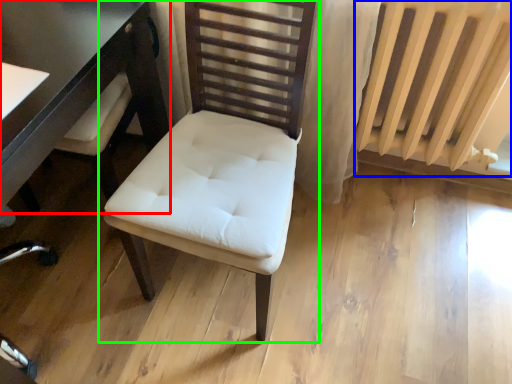
Question: Which is farther away from table (highlighted by a red box)? radiator (highlighted by a blue box) or chair (highlighted by a green box)?

Choices:
 (A) radiator
 (B) chair

Answer: (A)